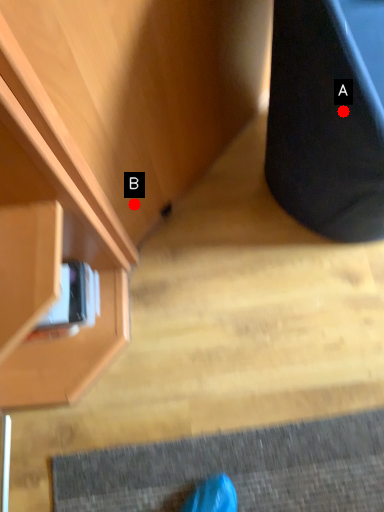
Question: Two points are circled on the image, labeled by A and B beside each circle. Among these points, which one is nearest to the camera?

Choices:
 (A) A is closer
 (B) B is closer

Answer: (A)